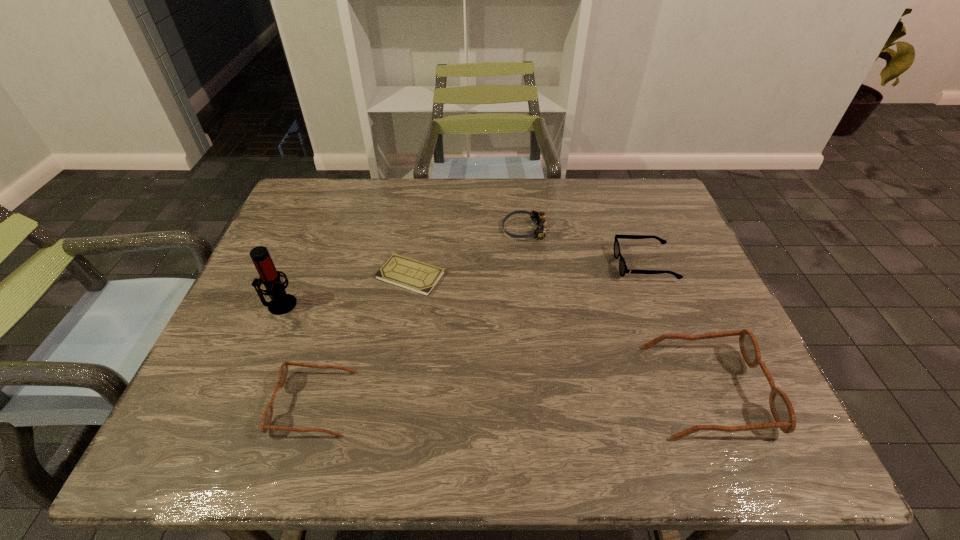
Where is `vacant space located through the lenses of the farthest object`? This screenshot has width=960, height=540. vacant space located through the lenses of the farthest object is located at coordinates (420, 230).

Locate an element on the screen. free space located 0.350m through the lenses of the farthest object is located at coordinates (383, 230).

Locate an element on the screen. Image resolution: width=960 pixels, height=540 pixels. vacant space located 0.270m through the lenses of the farthest object is located at coordinates (410, 230).

The height and width of the screenshot is (540, 960). Find the location of `free region located on the arms of the shortest spectacles`. free region located on the arms of the shortest spectacles is located at coordinates (595, 265).

The image size is (960, 540). Identify the location of blank area located on the arms of the shortest spectacles. (540, 265).

At what (x,y) coordinates should I click in order to perform the action: click on free spot located 0.320m on the arms of the shortest spectacles. Please return your answer as a coordinate pair (x, y). Looking at the image, I should click on (498, 265).

Identify the location of vacant area situated 0.150m on the back of the leftmost object. The height and width of the screenshot is (540, 960). (300, 255).

The height and width of the screenshot is (540, 960). I want to click on blank space located 0.200m on the left of the shortest object, so click(300, 275).

The height and width of the screenshot is (540, 960). I want to click on object present at the far edge, so click(538, 217).

The height and width of the screenshot is (540, 960). I want to click on object that is at the left edge, so click(281, 303).